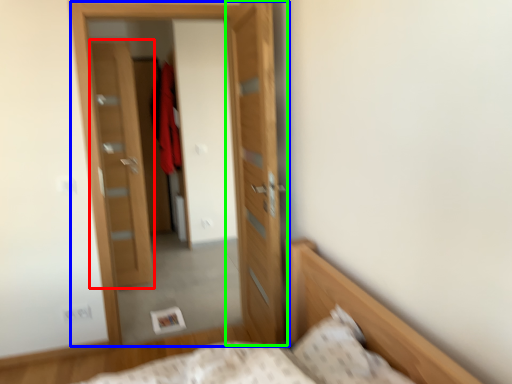
Question: Which is farther away from door (highlighted by a red box)? door (highlighted by a blue box) or door (highlighted by a green box)?

Choices:
 (A) door
 (B) door

Answer: (B)